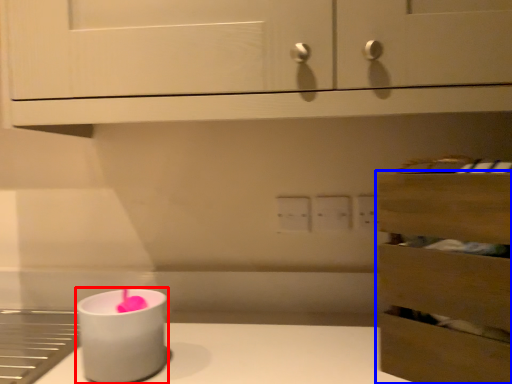
Question: Which point is closer to the camera, candle holder (highlighted by a red box) or drawer (highlighted by a blue box)?

Choices:
 (A) candle holder
 (B) drawer

Answer: (B)